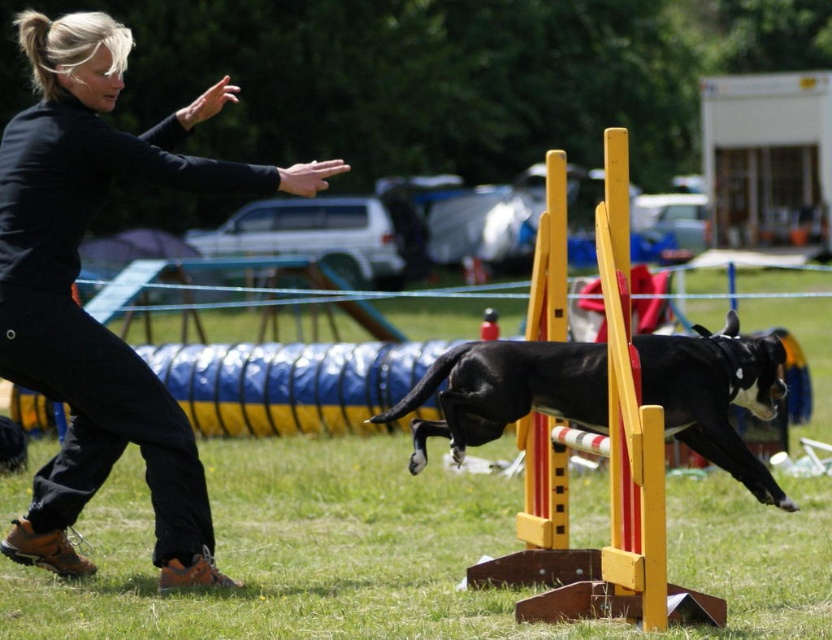
Consider the image. You are a photographer standing at the back of the agility course. You want to capture a photo of the black matte pants at lower left and the yellow wooden hurdle at center in the same frame. Which object should you focus on first if you want to ensure both are in focus without adjusting your camera settings?

A: The black matte pants at lower left has a greater height compared to the yellow wooden hurdle at center. Since the black matte pants at lower left is taller, you should focus on it first to ensure both are in focus.

You are a spectator at the dog agility competition. You see the black glossy dog at center and the black matte pants at lower left. Which object is closer to you?

The black matte pants at lower left is closer to you because the black glossy dog at center is behind it.

You are a photographer positioned at the back of the agility course. You need to capture a photo of the black matte pants at lower left and the yellow wooden hurdle at center. Which object should you zoom in on to ensure it takes up more space in the photo?

The black matte pants at lower left is larger in size than the yellow wooden hurdle at center, so you should zoom in on the black matte pants at lower left to ensure it takes up more space in the photo.